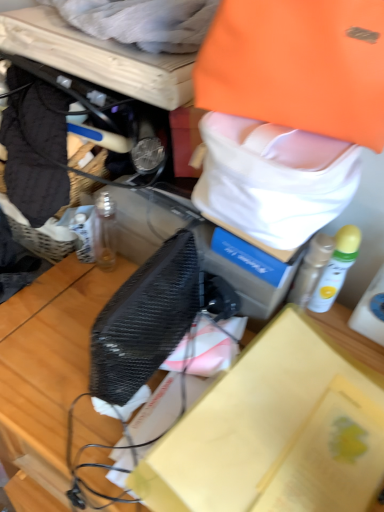
Where is `free point above black mesh box at center (from a real-world perspective)`? The height and width of the screenshot is (512, 384). free point above black mesh box at center (from a real-world perspective) is located at coordinates (275, 426).